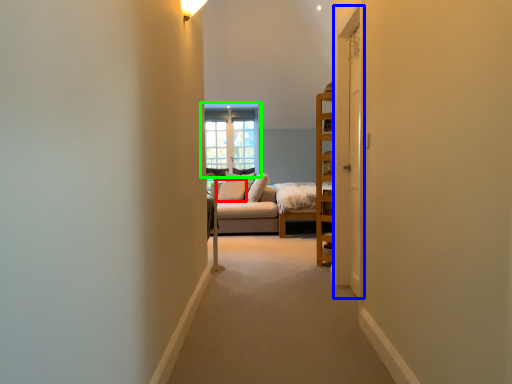
Question: Which object is the farthest from pillow (highlighted by a red box)? Choose among these: door (highlighted by a blue box) or window (highlighted by a green box).

Choices:
 (A) door
 (B) window

Answer: (A)